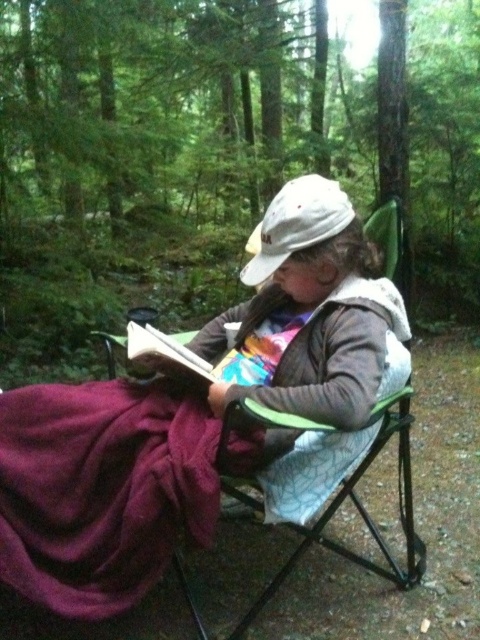
You are standing in the forest and see the green matte chair at center and the white fabric cap at center. Which object is positioned more to the left?

The green matte chair at center is positioned to the left of the white fabric cap at center, so it is more to the left.

From the picture: You are a hiker who has just arrived at this forest spot and wants to place a 20 cm wide water bottle between the matte purple blanket at lower left and the white fabric cap at center. Is there enough space for it?

The distance between the matte purple blanket at lower left and the white fabric cap at center is 23.51 centimeters. Since the water bottle is only 20 cm wide, there is enough space to place it between them.

You are an observer in the forest scene. You notice the matte purple blanket at lower left and the white fabric cap at center. Which object has a greater height?

The matte purple blanket at lower left is taller than the white fabric cap at center.